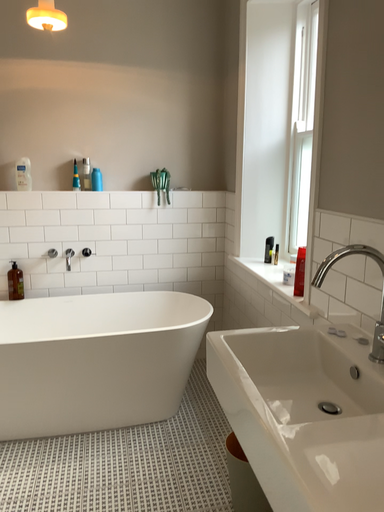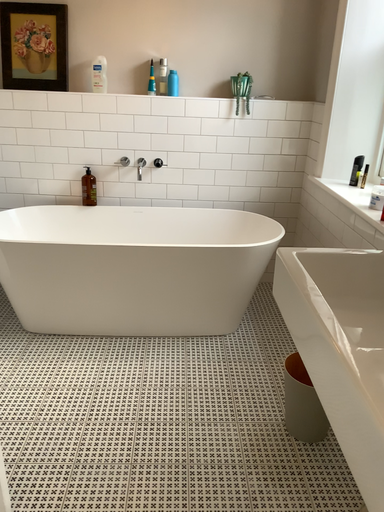
Question: How did the camera likely rotate when shooting the video?

Choices:
 (A) rotated downward
 (B) rotated upward

Answer: (A)